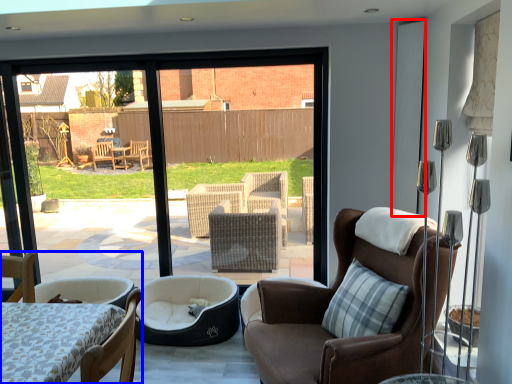
Question: Among these objects, which one is nearest to the camera, screen door (highlighted by a red box) or chair (highlighted by a blue box)?

Choices:
 (A) screen door
 (B) chair

Answer: (B)